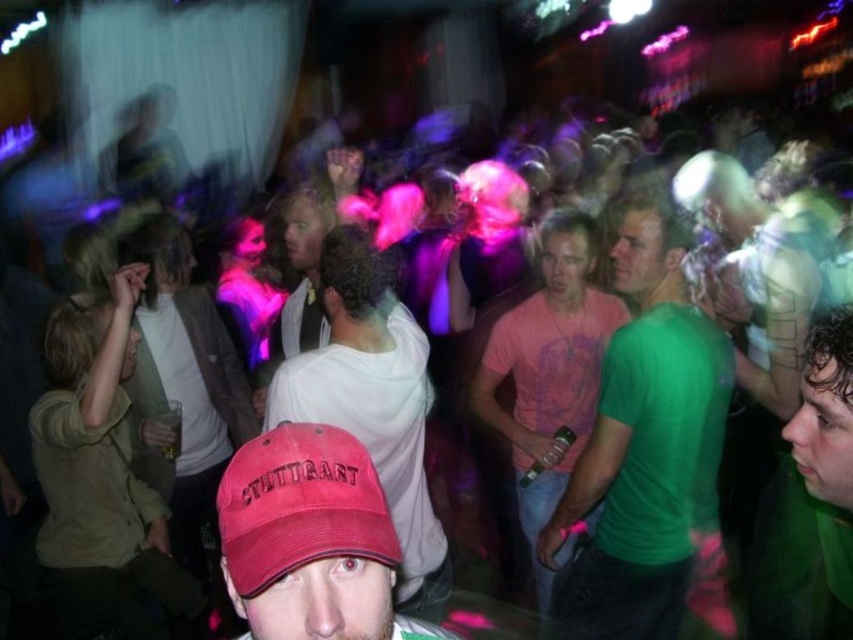
Question: Which of the following is the closest to the observer?

Choices:
 (A) pink cotton t-shirt at center
 (B) green matte shirt at center
 (C) white matte shirt at center

Answer: (C)

Question: Which point is closer to the camera?

Choices:
 (A) (848, 410)
 (B) (303, 369)
 (C) (277, 472)
 (D) (527, 524)

Answer: (C)

Question: Is white matte shirt at center to the left of green matte shirt at right from the viewer's perspective?

Choices:
 (A) yes
 (B) no

Answer: (A)

Question: Can you confirm if pink cotton t-shirt at center is positioned to the right of green matte shirt at right?

Choices:
 (A) yes
 (B) no

Answer: (B)

Question: Among these points, which one is farthest from the camera?

Choices:
 (A) (584, 346)
 (B) (409, 406)

Answer: (A)

Question: Does white matte shirt at center have a greater width compared to matte red baseball cap at center?

Choices:
 (A) no
 (B) yes

Answer: (B)